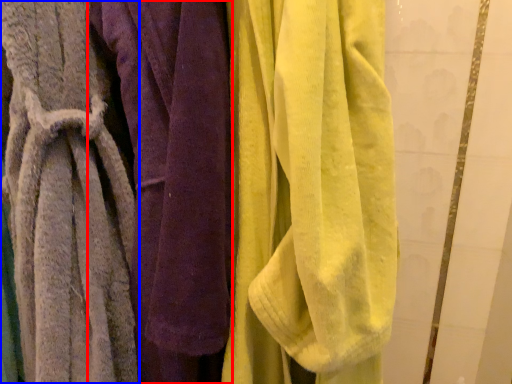
Question: Among these objects, which one is farthest to the camera, towel (highlighted by a red box) or towel (highlighted by a blue box)?

Choices:
 (A) towel
 (B) towel

Answer: (A)